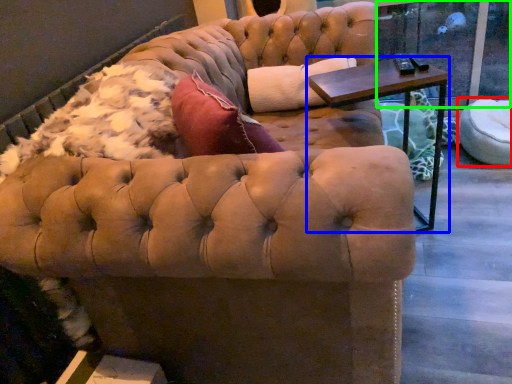
Question: Based on their relative distances, which object is nearer to swivel chair (highlighted by a red box)? Choose from table (highlighted by a blue box) and window screen (highlighted by a green box).

Choices:
 (A) table
 (B) window screen

Answer: (B)